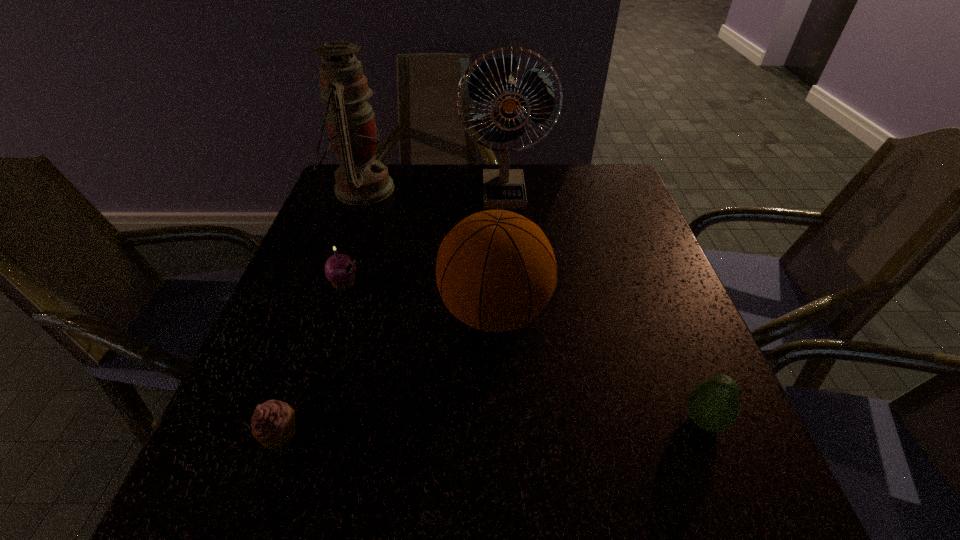
At what (x,y) coordinates should I click in order to perform the action: click on free point located on the left of the rightmost object. Please return your answer as a coordinate pair (x, y). Looking at the image, I should click on (585, 421).

Find the location of a particular element. The width and height of the screenshot is (960, 540). free location located on the face of the taller cupcake is located at coordinates (527, 283).

Locate an element on the screen. This screenshot has height=540, width=960. vacant region located 0.270m on the right of the shorter cupcake is located at coordinates (468, 433).

This screenshot has width=960, height=540. Identify the location of fan at the far edge. (503, 188).

The width and height of the screenshot is (960, 540). In order to click on oil lamp that is at the far edge in this screenshot , I will do `click(360, 180)`.

Where is `oil lamp positioned at the left edge`? oil lamp positioned at the left edge is located at coordinates (360, 180).

What are the coordinates of `object that is at the right edge` in the screenshot? It's located at (713, 404).

The image size is (960, 540). Identify the location of object that is at the far left corner. coord(360,180).

Image resolution: width=960 pixels, height=540 pixels. Find the location of `vacant area at the far edge`. vacant area at the far edge is located at coordinates (433, 206).

Locate an element on the screen. This screenshot has width=960, height=540. vacant area at the near edge of the desktop is located at coordinates (409, 523).